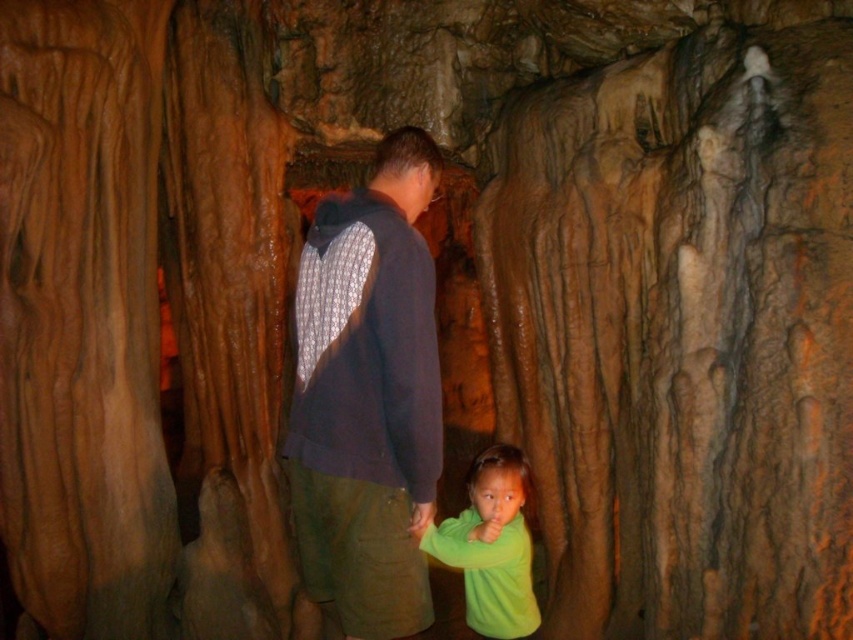
Question: Which object appears farthest from the camera in this image?

Choices:
 (A) dark blue hoodie at center
 (B) green matte shirt at lower center

Answer: (B)

Question: In this image, where is dark blue hoodie at center located relative to green matte shirt at lower center?

Choices:
 (A) above
 (B) below

Answer: (A)

Question: Which object appears farthest from the camera in this image?

Choices:
 (A) dark blue hoodie at center
 (B) green matte shirt at lower center

Answer: (B)

Question: Does dark blue hoodie at center come in front of green matte shirt at lower center?

Choices:
 (A) yes
 (B) no

Answer: (A)

Question: Is dark blue hoodie at center to the left of green matte shirt at lower center from the viewer's perspective?

Choices:
 (A) yes
 (B) no

Answer: (A)